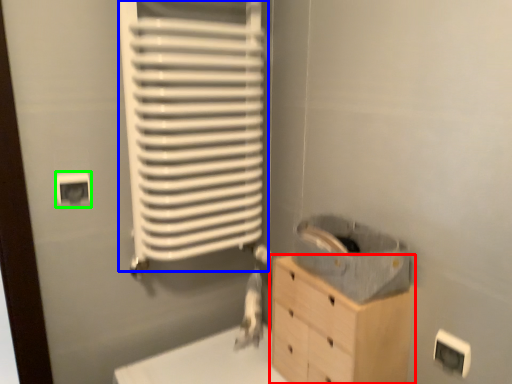
Question: Estimate the real-world distances between objects in this image. Which object is farther from chest of drawers (highlighted by a red box), radiator (highlighted by a blue box) or electric outlet (highlighted by a green box)?

Choices:
 (A) radiator
 (B) electric outlet

Answer: (B)